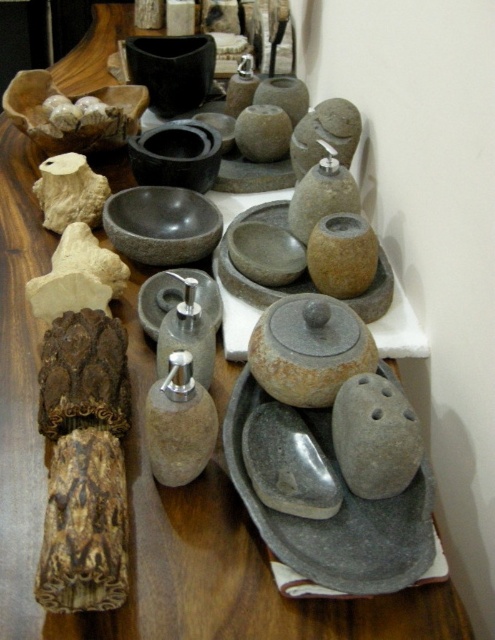
Describe the element at coordinates (375, 436) in the screenshot. I see `gray matte stone at center-right` at that location.

Where is `gray matte stone at center-right`? The height and width of the screenshot is (640, 495). gray matte stone at center-right is located at coordinates (375, 436).

What are the coordinates of `gray matte stone at center-right` in the screenshot? It's located at (375, 436).

Is point (295, 480) positioned in front of point (198, 102)?

Yes, it is in front of point (198, 102).

Between gray polished stone at center and black stone pot at upper center, which one is positioned higher?

black stone pot at upper center

Locate an element on the screen. This screenshot has height=640, width=495. gray polished stone at center is located at coordinates (288, 464).

Locate an element on the screen. The height and width of the screenshot is (640, 495). gray polished stone at center is located at coordinates (288, 464).

Which is behind, point (373, 461) or point (171, 74)?

Point (171, 74)

Does gray matte stone at center-right appear under black stone pot at upper center?

Indeed, gray matte stone at center-right is positioned under black stone pot at upper center.

Between point (394, 396) and point (214, 60), which one is positioned behind?

Point (214, 60)

At what (x,y) coordinates should I click in order to perform the action: click on gray matte stone at center-right. Please return your answer as a coordinate pair (x, y). This screenshot has width=495, height=640. Looking at the image, I should click on (375, 436).